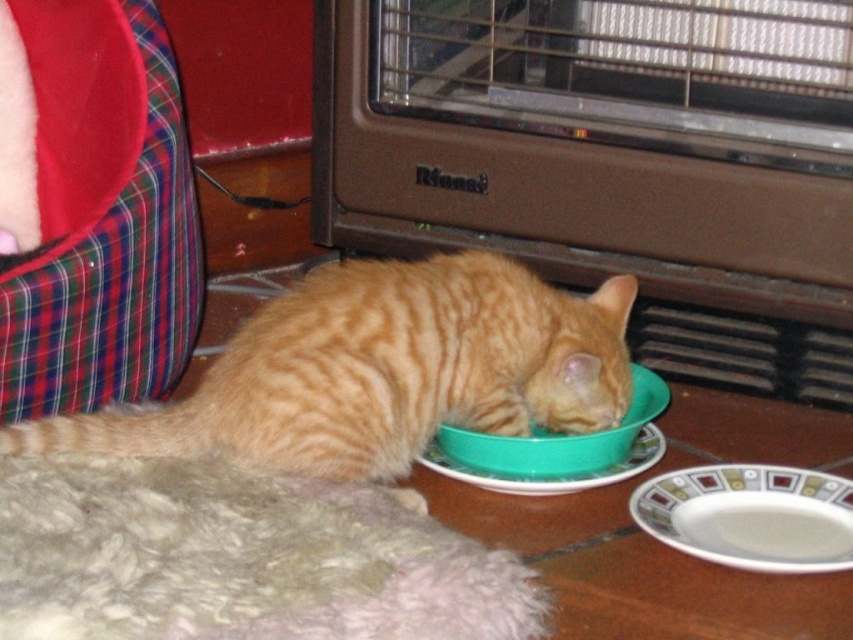
Is orange fur cat at lower left above green plastic plate at lower center?

Correct, orange fur cat at lower left is located above green plastic plate at lower center.

Between point (426, 353) and point (549, 477), which one is positioned in front?

Point (549, 477) is more forward.

Which is behind, point (74, 420) or point (438, 467)?

The point (438, 467) is more distant.

This screenshot has width=853, height=640. What are the coordinates of `orange fur cat at lower left` in the screenshot? It's located at (381, 371).

Is point (828, 564) positioned before point (518, 461)?

Yes, point (828, 564) is in front of point (518, 461).

Is white glossy plate at lower right bigger than green plastic bowl at lower center?

Incorrect, white glossy plate at lower right is not larger than green plastic bowl at lower center.

This screenshot has height=640, width=853. What are the coordinates of `white glossy plate at lower right` in the screenshot? It's located at coord(750,516).

Where is `white glossy plate at lower right`? This screenshot has width=853, height=640. white glossy plate at lower right is located at coordinates (750, 516).

Can you confirm if green plastic bowl at lower center is smaller than green plastic plate at lower center?

No.

Is point (665, 390) positioned behind point (647, 426)?

No, (665, 390) is in front of (647, 426).

Identify the location of green plastic bowl at lower center. The image size is (853, 640). (556, 440).